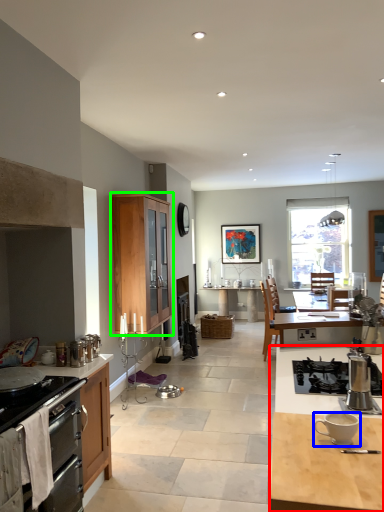
Question: Estimate the real-world distances between objects in this image. Which object is closer to desk (highlighted by a red box), coffee cup (highlighted by a blue box) or cabinetry (highlighted by a green box)?

Choices:
 (A) coffee cup
 (B) cabinetry

Answer: (A)